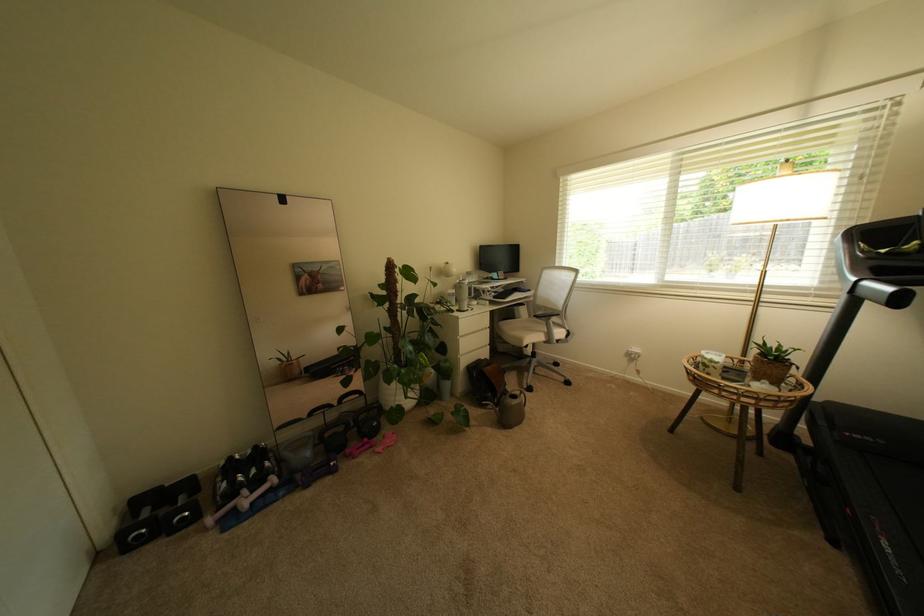
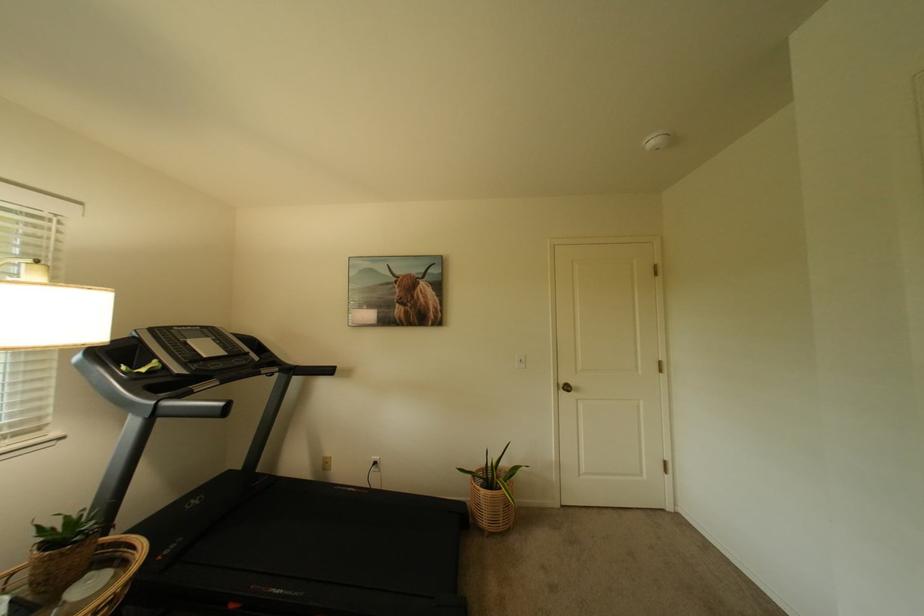
Find the pixel in the second image that matches (758,387) in the first image.

(73, 605)